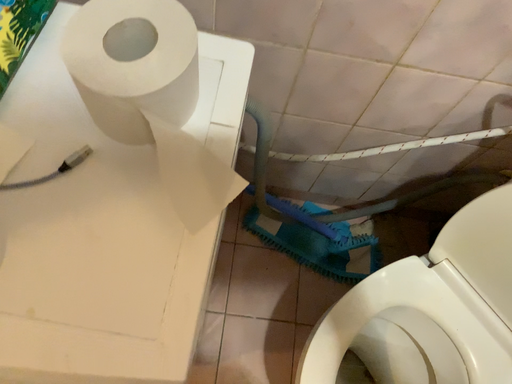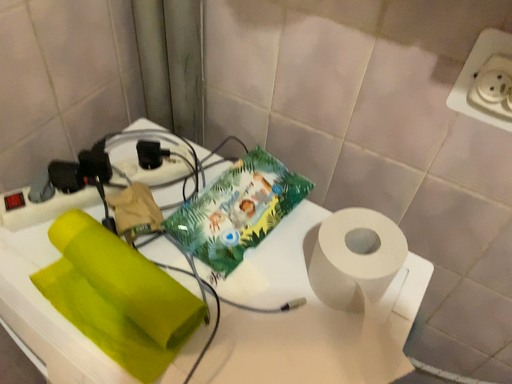
Question: Which way did the camera rotate in the video?

Choices:
 (A) rotated upward
 (B) rotated downward

Answer: (A)